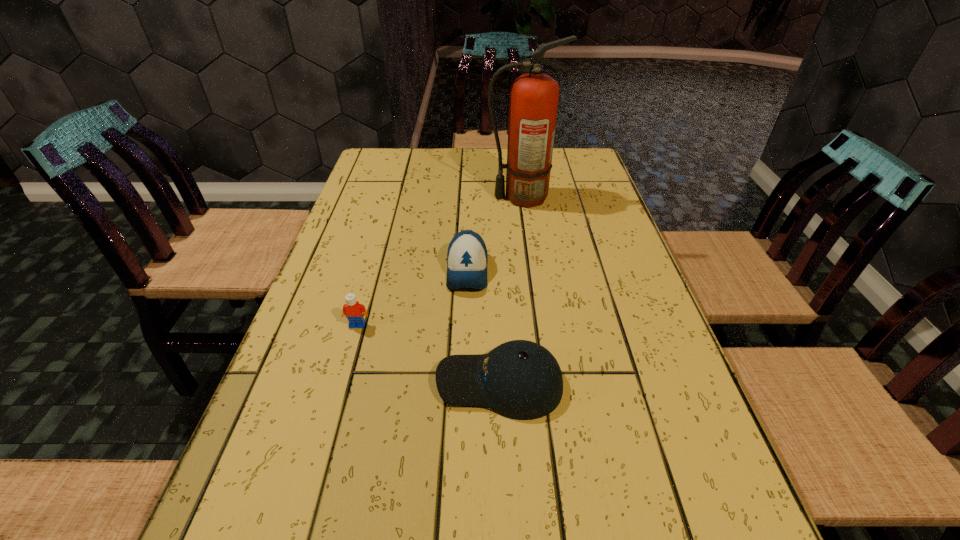
Find the location of `free region located on the face of the third farthest object`. free region located on the face of the third farthest object is located at coordinates (316, 472).

This screenshot has height=540, width=960. Find the location of `vacant point located on the front-facing side of the nearer baseball cap`. vacant point located on the front-facing side of the nearer baseball cap is located at coordinates (399, 383).

The height and width of the screenshot is (540, 960). What are the coordinates of `free spot located 0.300m on the front-facing side of the nearer baseball cap` in the screenshot? It's located at (278, 383).

Where is `free region located 0.270m on the front-facing side of the nearer baseball cap`? free region located 0.270m on the front-facing side of the nearer baseball cap is located at coordinates pyautogui.click(x=294, y=383).

Locate an element on the screen. This screenshot has width=960, height=540. object that is at the left edge is located at coordinates (352, 309).

At what (x,y) coordinates should I click in order to perform the action: click on object present at the right edge. Please return your answer as a coordinate pair (x, y). The width and height of the screenshot is (960, 540). Looking at the image, I should click on tap(533, 103).

Identify the location of vacant space at the far edge of the desktop. This screenshot has height=540, width=960. (455, 178).

Find the location of a particular element. Image resolution: width=960 pixels, height=540 pixels. free space at the left edge is located at coordinates (348, 267).

The height and width of the screenshot is (540, 960). In the image, there is a desktop. Find the location of `free space at the right edge`. free space at the right edge is located at coordinates (572, 195).

Where is `vacant point located between the second farthest object and the nearest object`? The image size is (960, 540). vacant point located between the second farthest object and the nearest object is located at coordinates (484, 327).